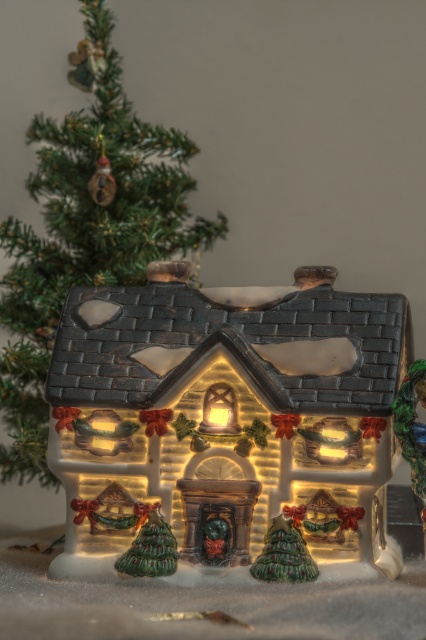
Who is higher up, matte ceramic house at center or green textured christmas tree at upper left?

Positioned higher is green textured christmas tree at upper left.

Between matte ceramic house at center and green textured christmas tree at upper left, which one appears on the right side from the viewer's perspective?

Positioned to the right is matte ceramic house at center.

This screenshot has height=640, width=426. What do you see at coordinates (227, 428) in the screenshot?
I see `matte ceramic house at center` at bounding box center [227, 428].

What are the coordinates of `matte ceramic house at center` in the screenshot? It's located at (227, 428).